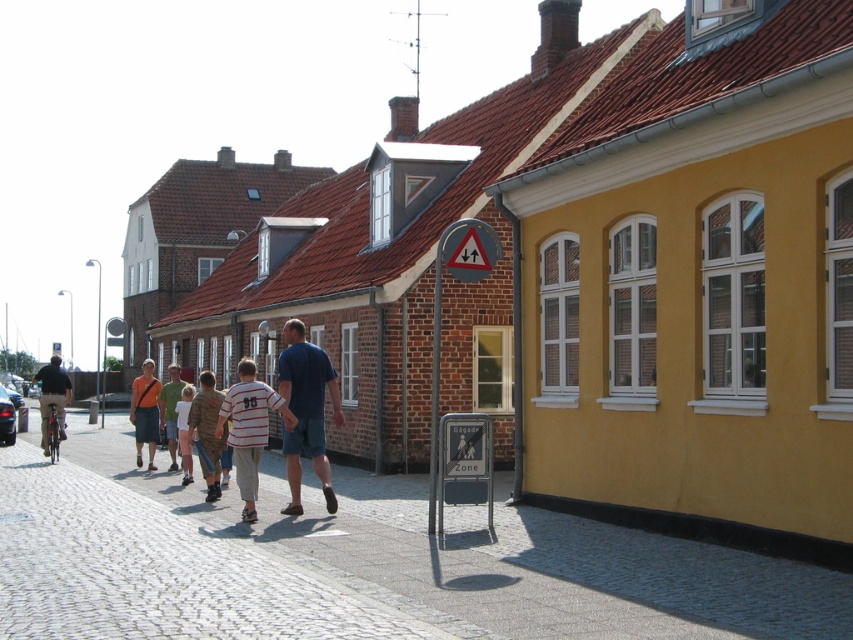
The image size is (853, 640). What do you see at coordinates (469, 250) in the screenshot?
I see `metallic reflective yield sign at center` at bounding box center [469, 250].

How far apart are metallic reflective yield sign at center and matte black bicycle at left?

metallic reflective yield sign at center is 13.42 meters from matte black bicycle at left.

Between point (463, 269) and point (57, 403), which one is positioned behind?

Point (57, 403)

This screenshot has height=640, width=853. Identify the location of metallic reflective yield sign at center. (469, 250).

In order to click on cobblestone pavement at lower left in this screenshot , I will do `click(358, 563)`.

Can you confirm if cobblestone pavement at lower left is thinner than metallic reflective yield sign at center?

No, cobblestone pavement at lower left is not thinner than metallic reflective yield sign at center.

Is cobblestone pavement at lower left to the right of metallic reflective yield sign at center from the viewer's perspective?

Incorrect, cobblestone pavement at lower left is not on the right side of metallic reflective yield sign at center.

Which is in front, point (264, 490) or point (448, 232)?

Point (448, 232) is more forward.

Locate an element on the screen. cobblestone pavement at lower left is located at coordinates (358, 563).